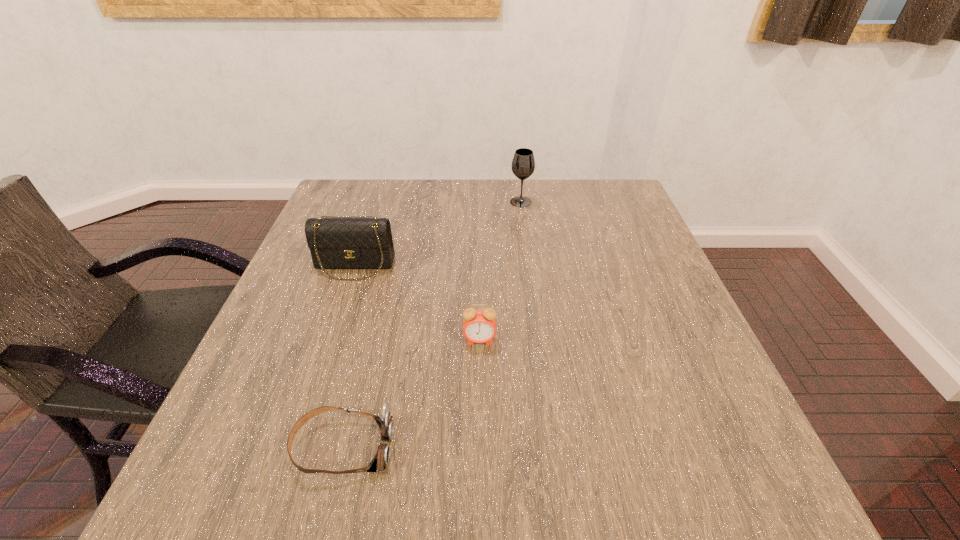
Find the location of a particular element. The width and height of the screenshot is (960, 540). vacant space situated on the face of the third tallest object is located at coordinates (480, 389).

I want to click on vacant space located 0.300m on the front-facing side of the goggles, so click(x=577, y=447).

Locate an element on the screen. The height and width of the screenshot is (540, 960). object that is at the far edge is located at coordinates 523,164.

Identify the location of object present at the near edge. This screenshot has width=960, height=540. (385, 422).

Where is `clutch bag that is positioned at the left edge`? Image resolution: width=960 pixels, height=540 pixels. clutch bag that is positioned at the left edge is located at coordinates (335, 243).

The height and width of the screenshot is (540, 960). In order to click on goggles at the left edge in this screenshot , I will do pyautogui.click(x=385, y=422).

At what (x,y) coordinates should I click in order to perform the action: click on object that is at the near left corner. Please return your answer as a coordinate pair (x, y). The height and width of the screenshot is (540, 960). Looking at the image, I should click on click(385, 422).

Image resolution: width=960 pixels, height=540 pixels. What are the coordinates of `blank space at the far edge` in the screenshot? It's located at (565, 180).

You are a GUI agent. You are given a task and a screenshot of the screen. Output one action in this format:
    pyautogui.click(x=<x>, y=<y>)
    Task: Click on the vacant space at the near edge of the desktop
    This screenshot has height=540, width=960.
    Given the screenshot: What is the action you would take?
    click(x=477, y=506)

You are a GUI agent. You are given a task and a screenshot of the screen. Output one action in this format:
    pyautogui.click(x=<x>, y=<y>)
    Task: Click on the vacant space at the left edge of the desktop
    
    Given the screenshot: What is the action you would take?
    click(251, 438)